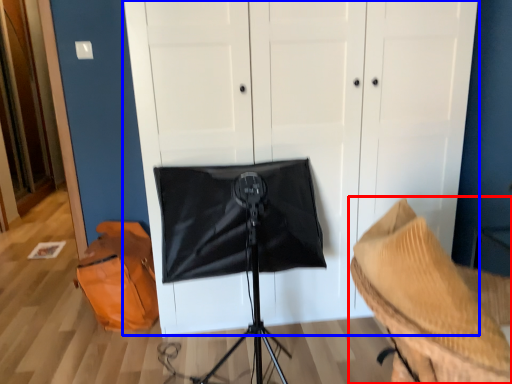
Question: Which object appears closest to the camera in this image, furniture (highlighted by a red box) or dresser (highlighted by a blue box)?

Choices:
 (A) furniture
 (B) dresser

Answer: (A)